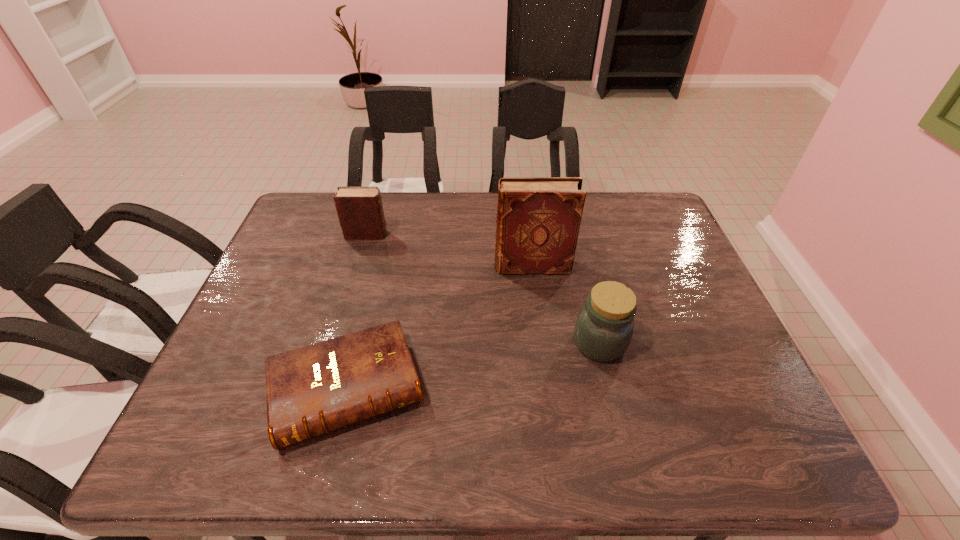
The height and width of the screenshot is (540, 960). I want to click on vacant area in the image that satisfies the following two spatial constraints: 1. on the spine side of the farthest object; 2. on the back side of the shortest object, so click(322, 389).

Where is `vacant area that satisfies the following two spatial constraints: 1. on the back side of the nearer hardback book; 2. on the spine side of the diary`? vacant area that satisfies the following two spatial constraints: 1. on the back side of the nearer hardback book; 2. on the spine side of the diary is located at coordinates (385, 234).

You are a GUI agent. You are given a task and a screenshot of the screen. Output one action in this format:
    pyautogui.click(x=<x>, y=<y>)
    Task: Click on the blank space that satisfies the following two spatial constraints: 1. on the spine side of the taller hardback book; 2. on the front side of the shorter hardback book
    The image size is (960, 540).
    Given the screenshot: What is the action you would take?
    pyautogui.click(x=547, y=389)

The image size is (960, 540). I want to click on free space that satisfies the following two spatial constraints: 1. on the spine side of the diary; 2. on the right side of the jar, so click(335, 343).